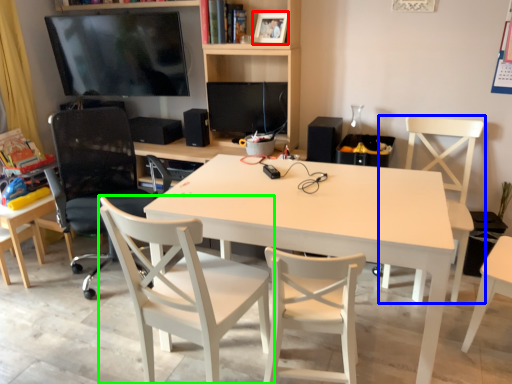
Question: Which is nearer to the picture frame (highlighted by a red box)? chair (highlighted by a blue box) or chair (highlighted by a green box).

Choices:
 (A) chair
 (B) chair

Answer: (A)